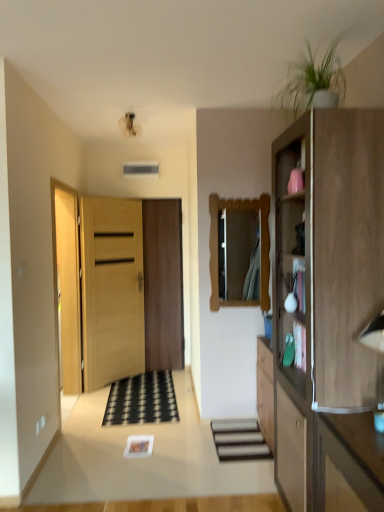
Where is `blank space situated above wooden mirror at center (from a real-world perspective)`? The image size is (384, 512). blank space situated above wooden mirror at center (from a real-world perspective) is located at coordinates (240, 187).